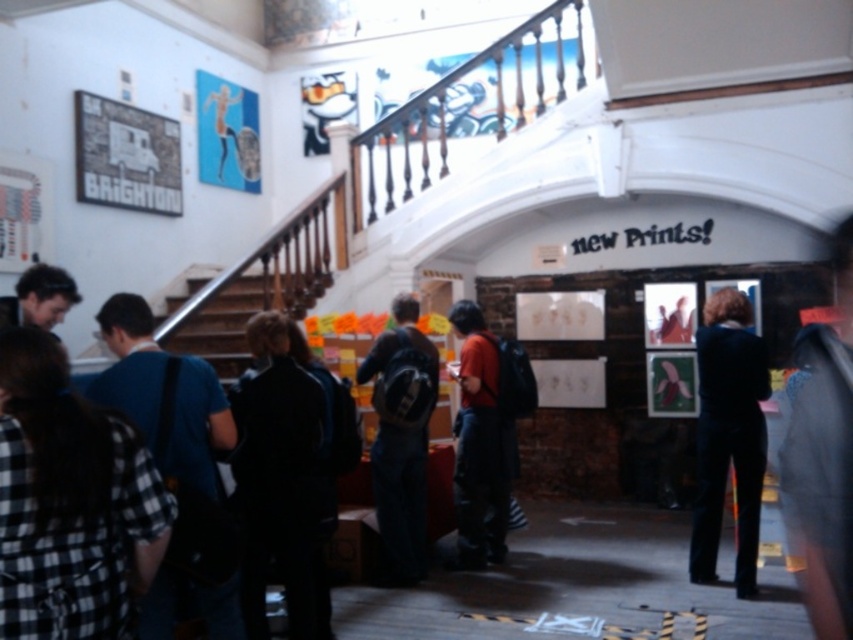
Image resolution: width=853 pixels, height=640 pixels. Describe the element at coordinates (280, 481) in the screenshot. I see `black fabric jacket at center` at that location.

Can you confirm if black fabric jacket at center is positioned above blue fabric shirt at left?

Incorrect, black fabric jacket at center is not positioned above blue fabric shirt at left.

What do you see at coordinates (280, 481) in the screenshot? I see `black fabric jacket at center` at bounding box center [280, 481].

This screenshot has width=853, height=640. What are the coordinates of `black fabric jacket at center` in the screenshot? It's located at (280, 481).

Consider the image. Is black fabric jacket at center below dark blue suit at center?

Yes.

Does black fabric jacket at center have a lesser height compared to dark blue suit at center?

Indeed, black fabric jacket at center has a lesser height compared to dark blue suit at center.

Consider the image. Who is more forward, (285, 588) or (743, 483)?

Point (285, 588) is in front.

Locate an element on the screen. black fabric jacket at center is located at coordinates (280, 481).

Which is above, checkered fabric shirt at left or dark blue suit at center?

checkered fabric shirt at left is higher up.

Measure the distance from checkered fabric shirt at left to dark blue suit at center.

A distance of 11.42 feet exists between checkered fabric shirt at left and dark blue suit at center.

At what (x,y) coordinates should I click in order to perform the action: click on checkered fabric shirt at left. Please return your answer as a coordinate pair (x, y). Image resolution: width=853 pixels, height=640 pixels. Looking at the image, I should click on (70, 502).

Where is `checkered fabric shirt at left`? This screenshot has height=640, width=853. checkered fabric shirt at left is located at coordinates (70, 502).